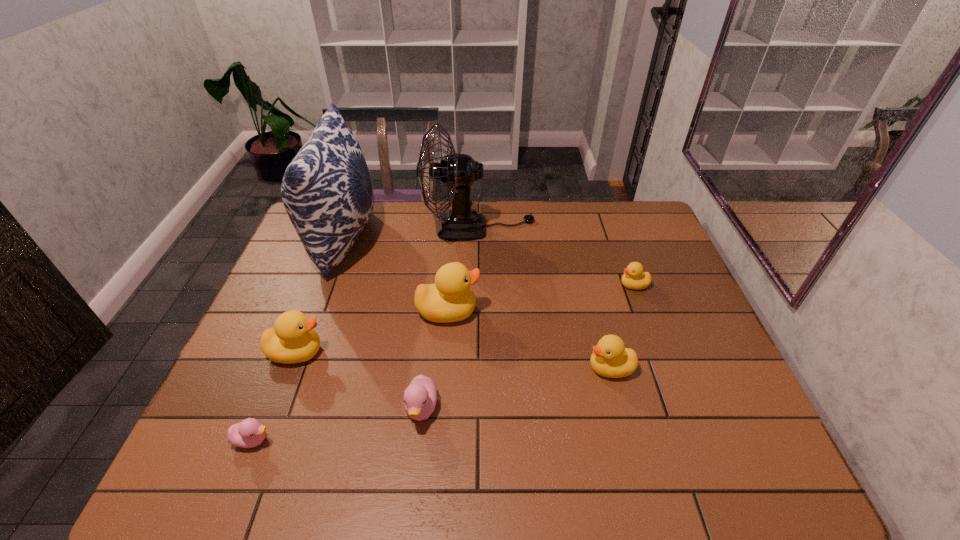
At what (x,y) coordinates should I click in order to perform the action: click on free space located on the face of the rightmost yellow duckling. Please return your answer as a coordinate pair (x, y). The image size is (960, 540). Looking at the image, I should click on (549, 285).

At what (x,y) coordinates should I click in order to perform the action: click on vacant space located 0.180m on the face of the rightmost yellow duckling. Please return your answer as a coordinate pair (x, y). This screenshot has width=960, height=540. Looking at the image, I should click on (559, 285).

In order to click on free location located on the face of the rightmost yellow duckling in this screenshot , I will do `click(563, 285)`.

Where is `vacant area situated on the front-facing side of the smaller pink duckling`? This screenshot has width=960, height=540. vacant area situated on the front-facing side of the smaller pink duckling is located at coordinates (378, 440).

Locate an element on the screen. cushion that is at the far edge is located at coordinates (327, 191).

The width and height of the screenshot is (960, 540). Identify the location of fan located in the far edge section of the desktop. tap(458, 172).

The image size is (960, 540). Identify the location of object that is at the near edge. (249, 433).

Locate an element on the screen. The image size is (960, 540). cushion at the left edge is located at coordinates (327, 191).

Where is `object that is at the right edge`? Image resolution: width=960 pixels, height=540 pixels. object that is at the right edge is located at coordinates pyautogui.click(x=634, y=278).

This screenshot has width=960, height=540. Identify the location of object located at the far left corner. (327, 191).